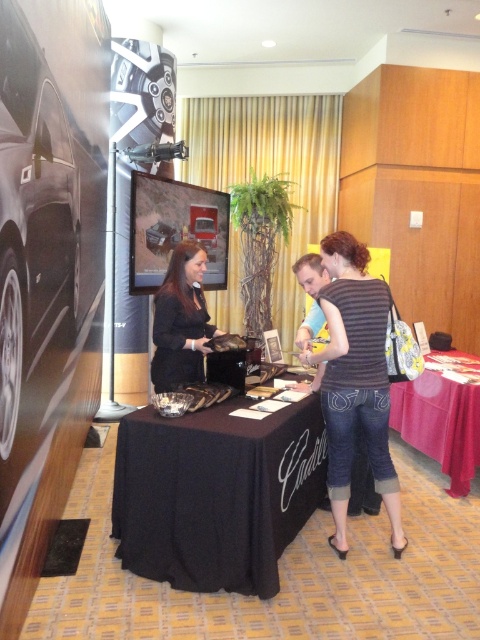
You are a guest at a Cadillac promotional event and want to grab a brochure from the table. However, you are standing behind the black matte dress at center. Can you reach the red fabric table at lower right without moving the dress?

The red fabric table at lower right is narrower than the black matte dress at center, so you might not be able to reach it without moving the dress since the dress is wider and blocking the path.

You are at a car exhibition and need to find the Cadillac brochures. The black cloth table at center and the red fabric table at lower right are both in your view. Which table is positioned lower in the image?

The black cloth table at center is located below the red fabric table at lower right, so it is positioned lower in the image.